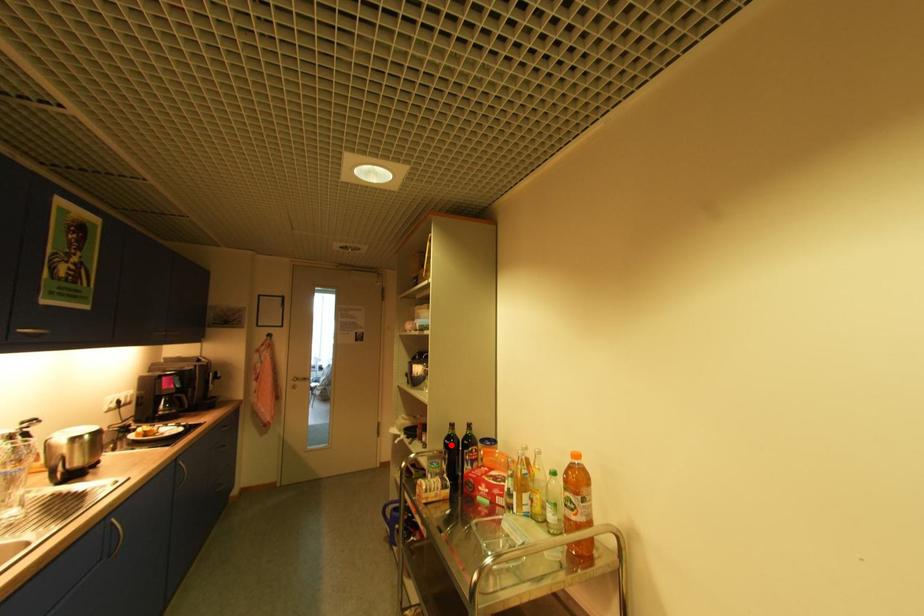
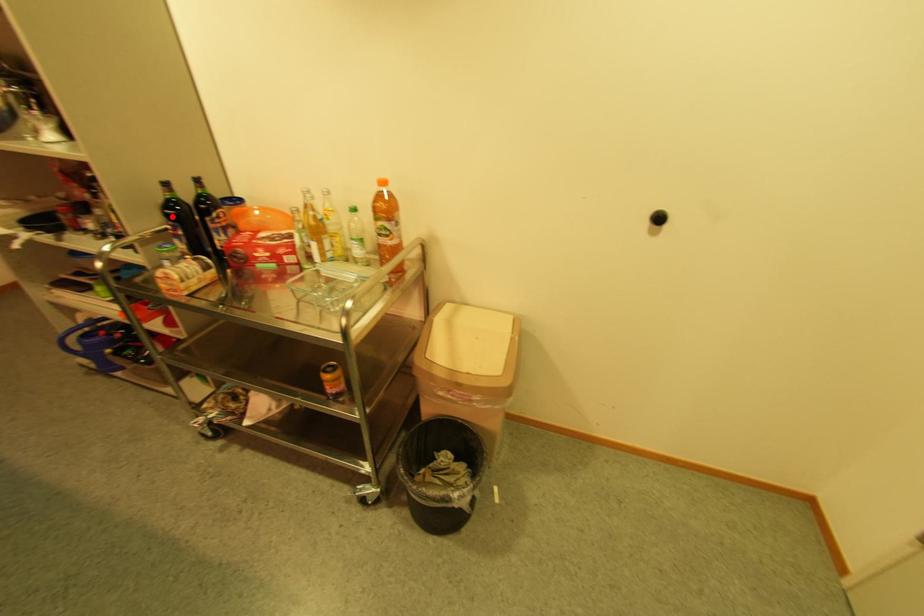
I am providing you with two images of the same scene from different viewpoints. A red point is marked on the first image and another point is marked on the second image. Is the marked point in image1 the same physical position as the marked point in image2?

Yes